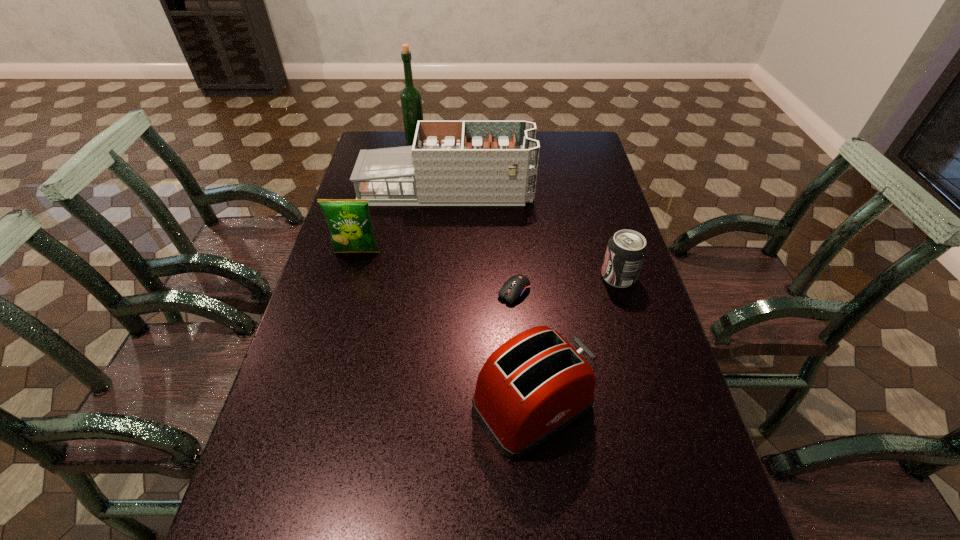
I want to click on the farthest object, so 411,102.

Where is `liquor`? liquor is located at coordinates (411, 102).

The width and height of the screenshot is (960, 540). What are the coordinates of `dollhouse` in the screenshot? It's located at (452, 163).

Where is `crisp (potato chip)`? The height and width of the screenshot is (540, 960). crisp (potato chip) is located at coordinates (351, 229).

Identify the location of toaster. (535, 384).

Find the location of a particular element. The image size is (960, 540). the second shortest object is located at coordinates (626, 251).

Find the location of a particular element. This screenshot has height=540, width=960. soda can is located at coordinates (626, 251).

At what (x,y) coordinates should I click in order to perform the action: click on the shortest object. Please return your answer as a coordinate pair (x, y). Image resolution: width=960 pixels, height=540 pixels. Looking at the image, I should click on (518, 286).

Locate an element on the screen. The image size is (960, 540). vacant space located on the right of the liquor is located at coordinates (466, 143).

You are a GUI agent. You are given a task and a screenshot of the screen. Output one action in this format:
    pyautogui.click(x=<x>, y=<y>)
    Task: Click on the vacant space located at the entrance of the second farthest object
    This screenshot has height=540, width=960.
    Given the screenshot: What is the action you would take?
    pyautogui.click(x=550, y=191)